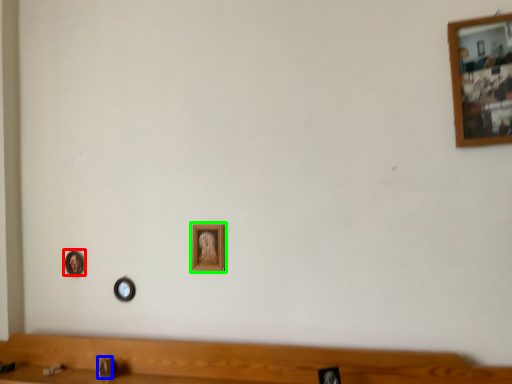
Question: Based on their relative distances, which object is farther from picture frame (highlighted by a red box)? Choose from faucet (highlighted by a blue box) and picture frame (highlighted by a green box).

Choices:
 (A) faucet
 (B) picture frame

Answer: (B)